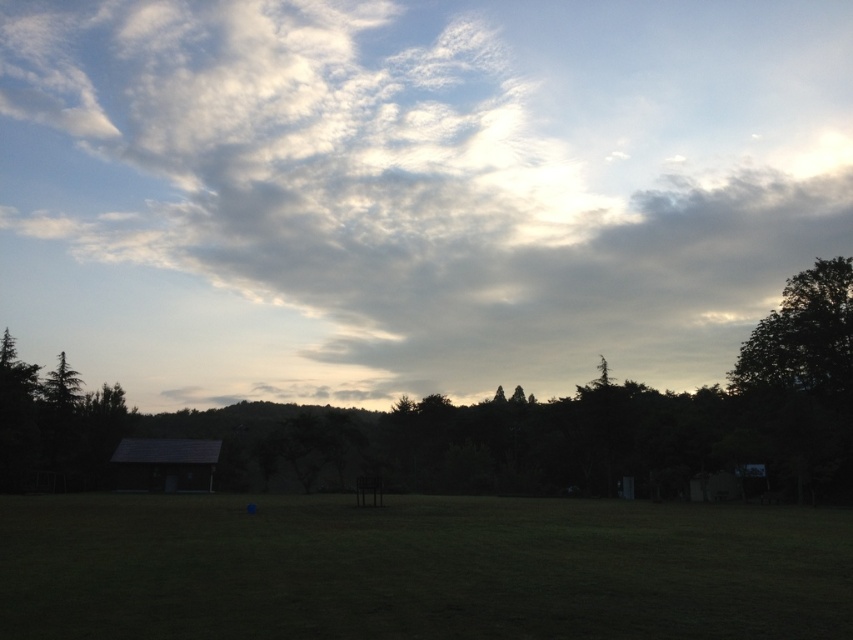
Is white fluffy cloud at upper center thinner than dark green leafy tree at right?

In fact, white fluffy cloud at upper center might be wider than dark green leafy tree at right.

How distant is white fluffy cloud at upper center from dark green leafy tree at right?

The distance of white fluffy cloud at upper center from dark green leafy tree at right is 348.22 meters.

Between point (253, 28) and point (842, 358), which one is positioned behind?

The point (253, 28) is more distant.

Identify the location of white fluffy cloud at upper center. The width and height of the screenshot is (853, 640). point(412,188).

Can you confirm if green grassy field at center is wider than green matte tree at left?

Correct, the width of green grassy field at center exceeds that of green matte tree at left.

Does green grassy field at center appear under green matte tree at left?

Yes, green grassy field at center is below green matte tree at left.

Locate an element on the screen. The image size is (853, 640). green grassy field at center is located at coordinates (419, 570).

The width and height of the screenshot is (853, 640). What are the coordinates of `green grassy field at center` in the screenshot? It's located at (419, 570).

Which is in front, point (334, 90) or point (54, 410)?

Point (54, 410) is more forward.

Is white fluffy cloud at upper center smaller than green matte tree at left?

Incorrect, white fluffy cloud at upper center is not smaller in size than green matte tree at left.

Between point (515, 44) and point (68, 397), which one is positioned behind?

The point (515, 44) is behind.

Identify the location of white fluffy cloud at upper center. The image size is (853, 640). (412, 188).